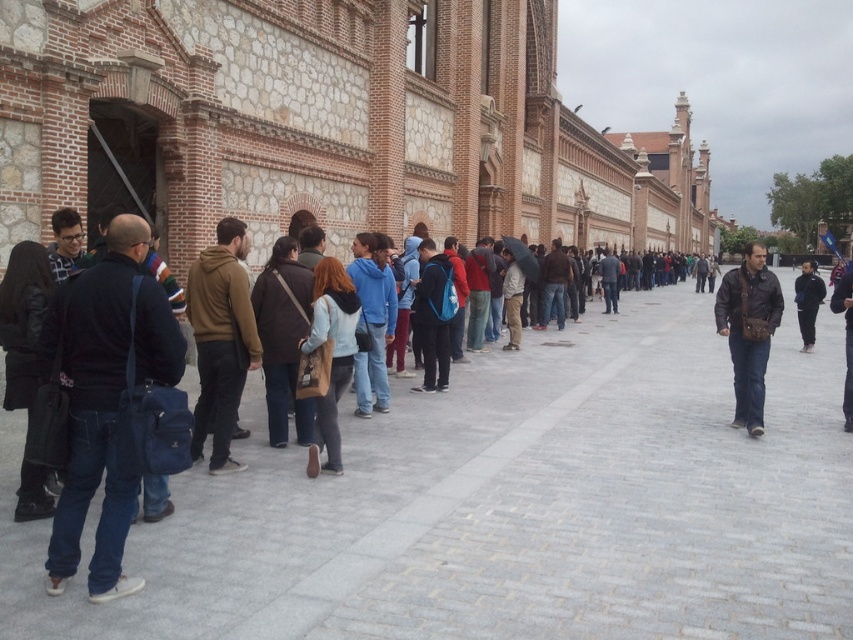
Question: Does dark blue jacket at center lie behind black leather jacket at center?

Choices:
 (A) yes
 (B) no

Answer: (A)

Question: Which of the following is the farthest from the observer?

Choices:
 (A) (325, 276)
 (B) (747, 376)
 (C) (795, 300)
 (D) (22, 481)

Answer: (C)

Question: Does brown suede jacket at center come in front of dark blue jacket at center?

Choices:
 (A) no
 (B) yes

Answer: (B)

Question: Which point is farther to the camera?

Choices:
 (A) dark blue fabric jacket at left
 (B) brown suede jacket at center
 (C) dark blue jacket at center
 (D) denim jacket at center

Answer: (C)

Question: Which object appears closest to the camera in this image?

Choices:
 (A) brown suede jacket at center
 (B) brown leather jacket at right
 (C) dark blue jeans at center

Answer: (C)

Question: Can you confirm if dark blue jeans at center is positioned to the left of dark blue fabric jacket at left?

Choices:
 (A) yes
 (B) no

Answer: (B)